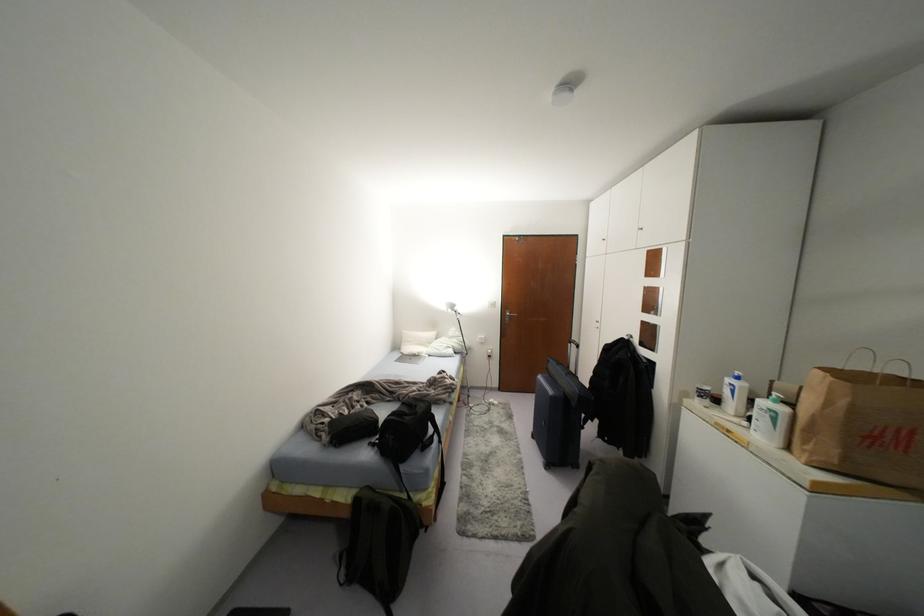
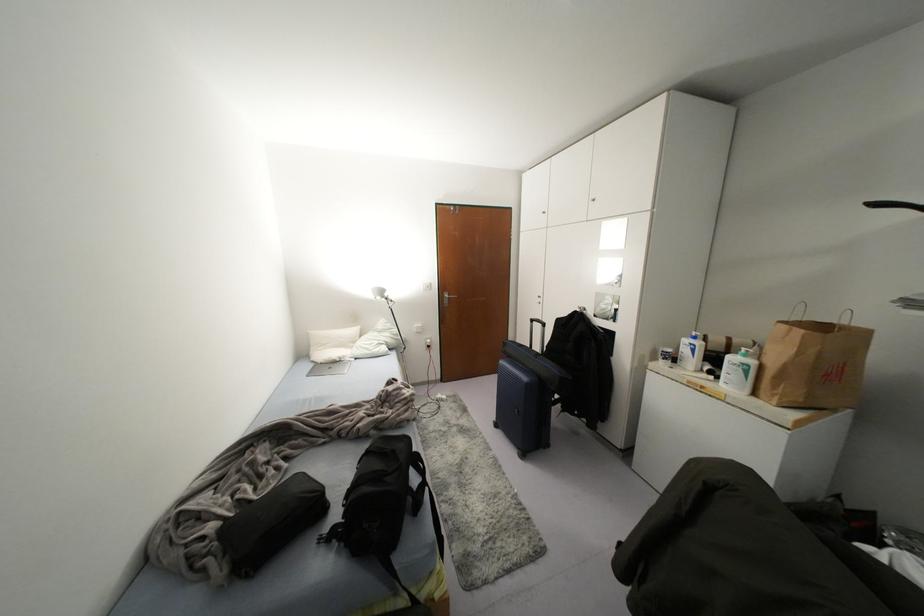
In the second image, find the point that corresponds to (733,391) in the first image.

(691, 350)